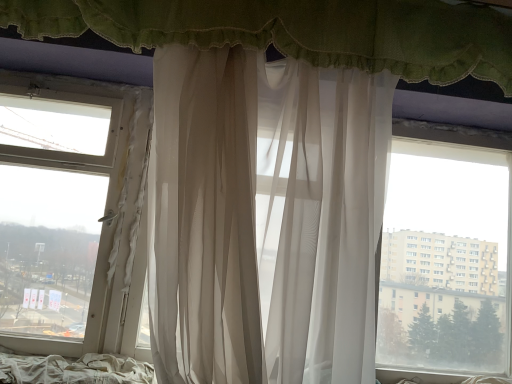
Question: From a real-world perspective, is white fabric bed at lower left below sheer white curtain at upper center, arranged as the 1th curtain when viewed from the top?

Choices:
 (A) no
 (B) yes

Answer: (B)

Question: From the image's perspective, is white fabric bed at lower left under sheer white curtain at upper center, acting as the 2th curtain starting from the bottom?

Choices:
 (A) yes
 (B) no

Answer: (A)

Question: Is white fabric bed at lower left facing away from sheer white curtain at upper center, acting as the 2th curtain starting from the bottom?

Choices:
 (A) no
 (B) yes

Answer: (A)

Question: From a real-world perspective, is white fabric bed at lower left physically above sheer white curtain at upper center, acting as the 2th curtain starting from the bottom?

Choices:
 (A) yes
 (B) no

Answer: (B)

Question: Can we say white fabric bed at lower left lies outside sheer white curtain at upper center, arranged as the 1th curtain when viewed from the top?

Choices:
 (A) yes
 (B) no

Answer: (A)

Question: Is white fabric bed at lower left to the left or to the right of sheer white curtain at upper center, arranged as the 1th curtain when viewed from the top, in the image?

Choices:
 (A) right
 (B) left

Answer: (B)

Question: Looking at the image, does white fabric bed at lower left seem bigger or smaller compared to sheer white curtain at upper center, arranged as the 1th curtain when viewed from the top?

Choices:
 (A) big
 (B) small

Answer: (B)

Question: From their relative heights in the image, would you say white fabric bed at lower left is taller or shorter than sheer white curtain at upper center, arranged as the 1th curtain when viewed from the top?

Choices:
 (A) short
 (B) tall

Answer: (A)

Question: In terms of width, does white fabric bed at lower left look wider or thinner when compared to sheer white curtain at upper center, acting as the 2th curtain starting from the bottom?

Choices:
 (A) thin
 (B) wide

Answer: (B)

Question: Is white fabric bed at lower left bigger or smaller than sheer white curtain at center, the first curtain ordered from the bottom?

Choices:
 (A) small
 (B) big

Answer: (A)

Question: Would you say white fabric bed at lower left is to the left or to the right of sheer white curtain at center, the first curtain ordered from the bottom, in the picture?

Choices:
 (A) right
 (B) left

Answer: (B)

Question: From a real-world perspective, is white fabric bed at lower left physically located above or below sheer white curtain at center, marked as the 2th curtain in a top-to-bottom arrangement?

Choices:
 (A) above
 (B) below

Answer: (B)

Question: In the image, is white fabric bed at lower left positioned in front of or behind sheer white curtain at center, the first curtain ordered from the bottom?

Choices:
 (A) front
 (B) behind

Answer: (B)

Question: Is sheer white curtain at upper center, arranged as the 1th curtain when viewed from the top, wider or thinner than white fabric bed at lower left?

Choices:
 (A) wide
 (B) thin

Answer: (B)

Question: From a real-world perspective, is sheer white curtain at upper center, arranged as the 1th curtain when viewed from the top, physically located above or below white fabric bed at lower left?

Choices:
 (A) below
 (B) above

Answer: (B)